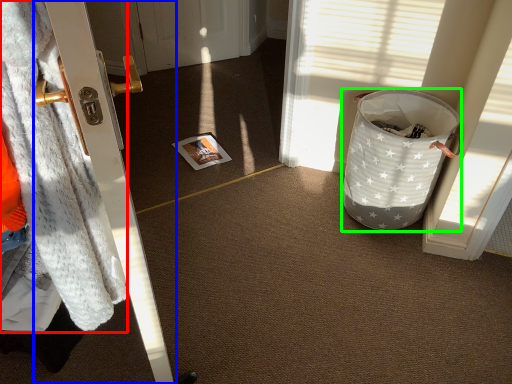
Question: Which is farther away from blanket (highlighted by a red box)? door (highlighted by a blue box) or trash bin/can (highlighted by a green box)?

Choices:
 (A) door
 (B) trash bin/can

Answer: (B)